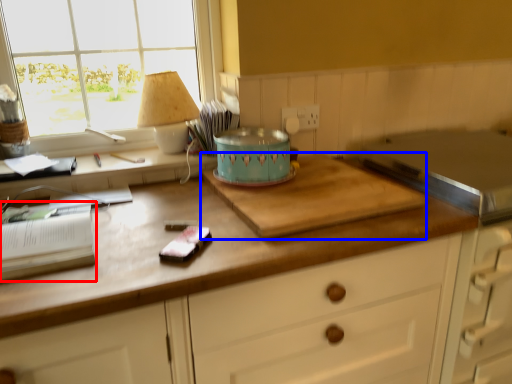
Question: Among these objects, which one is farthest to the camera, book (highlighted by a red box) or cutting board (highlighted by a blue box)?

Choices:
 (A) book
 (B) cutting board

Answer: (B)